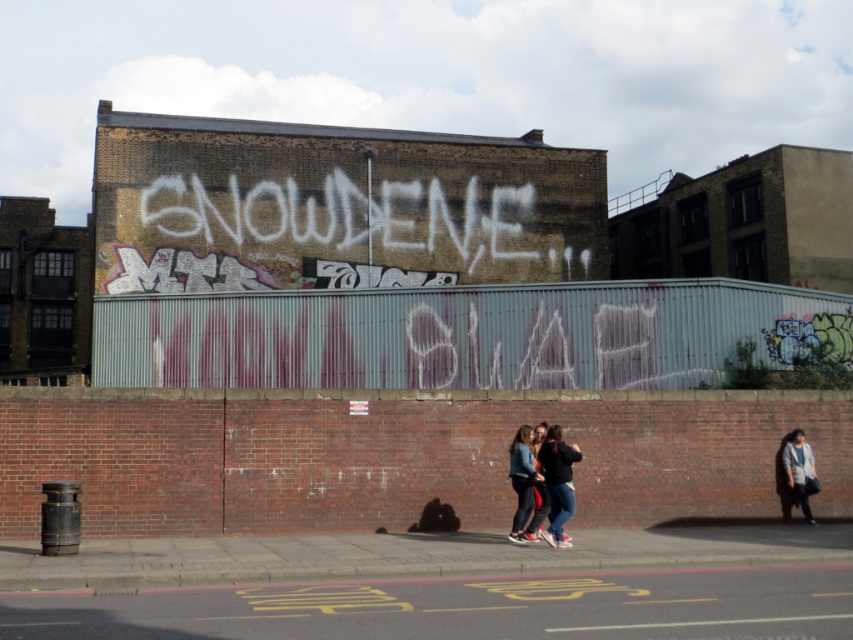
Does point (560, 500) come behind point (527, 496)?

No, (560, 500) is in front of (527, 496).

Which is in front, point (555, 442) or point (527, 483)?

Point (555, 442)

Find the location of `jeans at center`. jeans at center is located at coordinates (556, 481).

Measure the distance between white chalk graffiti at center and denim jacket at center.

white chalk graffiti at center and denim jacket at center are 27.20 meters apart from each other.

Does white chalk graffiti at center have a greater height compared to denim jacket at center?

Indeed, white chalk graffiti at center has a greater height compared to denim jacket at center.

The width and height of the screenshot is (853, 640). Describe the element at coordinates (347, 220) in the screenshot. I see `white chalk graffiti at center` at that location.

Where is `white chalk graffiti at center`? white chalk graffiti at center is located at coordinates (347, 220).

Can you confirm if white chalk graffiti at center is positioned above jeans at center?

Indeed, white chalk graffiti at center is positioned over jeans at center.

Does point (373, 236) come in front of point (563, 520)?

No, it is behind (563, 520).

At what (x,y) coordinates should I click in order to perform the action: click on white chalk graffiti at center. Please return your answer as a coordinate pair (x, y). The height and width of the screenshot is (640, 853). Looking at the image, I should click on (347, 220).